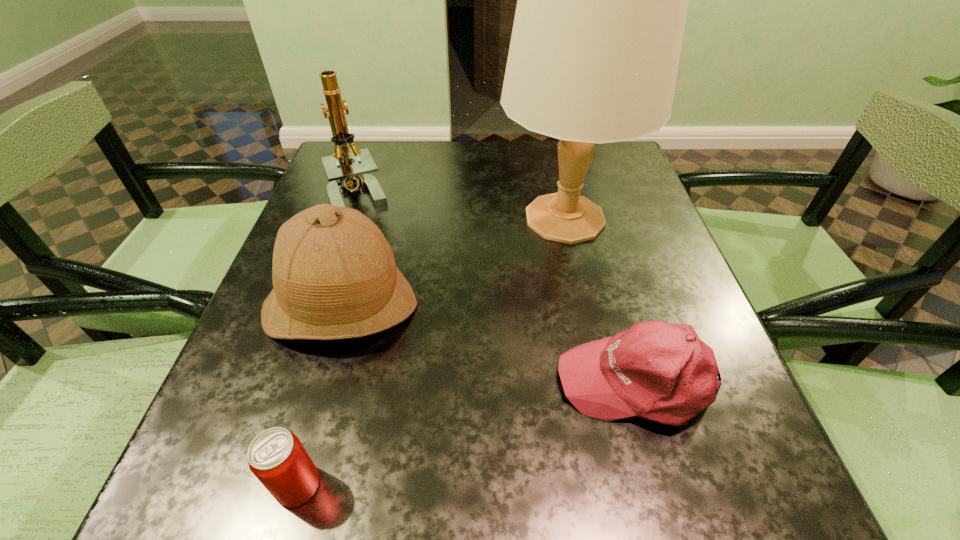
Where is `blank space located at the front of the baseball cap with the brim`? Image resolution: width=960 pixels, height=540 pixels. blank space located at the front of the baseball cap with the brim is located at coordinates (348, 381).

This screenshot has width=960, height=540. In order to click on free spot located 0.360m on the back of the nearest object in this screenshot , I will do `click(356, 278)`.

Where is `table lamp located in the far edge section of the desktop`? This screenshot has width=960, height=540. table lamp located in the far edge section of the desktop is located at coordinates (602, 0).

Locate an element on the screen. This screenshot has height=540, width=960. microscope located at the far edge is located at coordinates (344, 175).

Locate an element on the screen. The image size is (960, 540). object that is at the near edge is located at coordinates (277, 458).

You are a GUI agent. You are given a task and a screenshot of the screen. Output one action in this format:
    pyautogui.click(x=<x>, y=<y>)
    Task: Click on the microscope present at the left edge
    The width and height of the screenshot is (960, 540).
    Given the screenshot: What is the action you would take?
    pyautogui.click(x=344, y=175)

At what (x,y) coordinates should I click in order to perform the action: click on hat located in the left edge section of the desktop. Please return your answer as a coordinate pair (x, y). The width and height of the screenshot is (960, 540). Looking at the image, I should click on (334, 275).

I want to click on can located in the left edge section of the desktop, so click(277, 458).

Find the location of a particular element. table lamp that is positioned at the right edge is located at coordinates (602, 0).

Locate an element on the screen. baseball cap situated at the right edge is located at coordinates (663, 372).